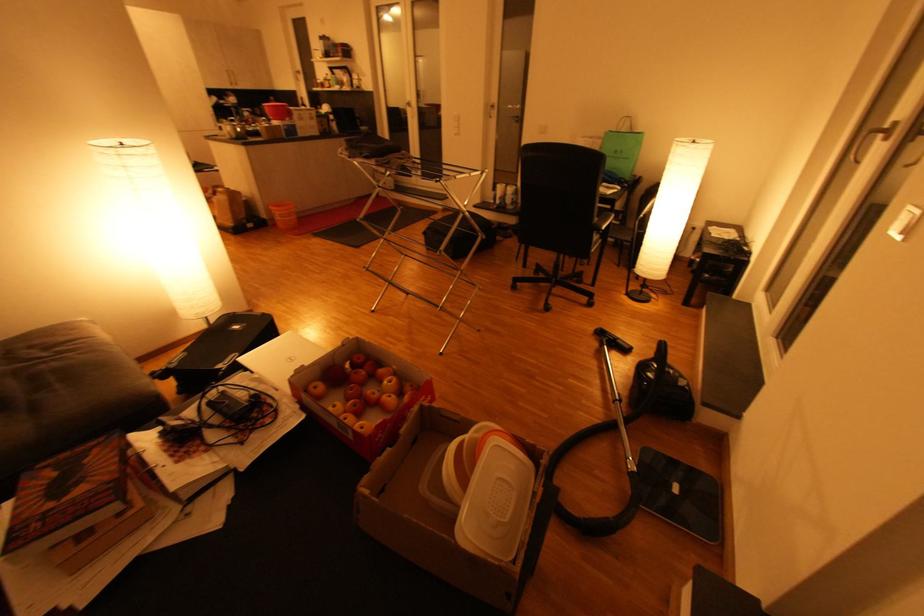
Image resolution: width=924 pixels, height=616 pixels. In order to click on white laptop in this screenshot , I will do `click(281, 358)`.